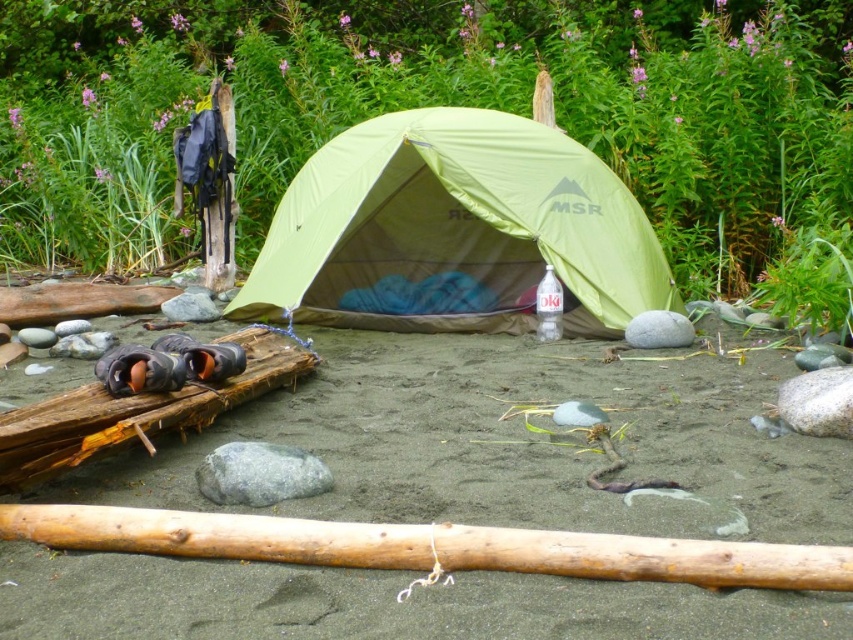
Question: Which of the following is the farthest from the observer?

Choices:
 (A) gray smooth rock at left
 (B) green fabric tent at center

Answer: (A)

Question: Is green fabric tent at center below smooth light brown log at center?

Choices:
 (A) yes
 (B) no

Answer: (B)

Question: Which object is the farthest from the gray smooth rock at lower center?

Choices:
 (A) gray smooth rock at left
 (B) green fabric tent at center

Answer: (A)

Question: Can you confirm if sandy brown sand at center is positioned above gray smooth rock at lower center?

Choices:
 (A) yes
 (B) no

Answer: (A)

Question: Can you confirm if smooth light brown log at center is smaller than gray smooth rock at left?

Choices:
 (A) yes
 (B) no

Answer: (B)

Question: Which is nearer to the gray smooth rock at center?

Choices:
 (A) sandy brown sand at center
 (B) gray smooth rock at left
 (C) smooth light brown log at center

Answer: (A)